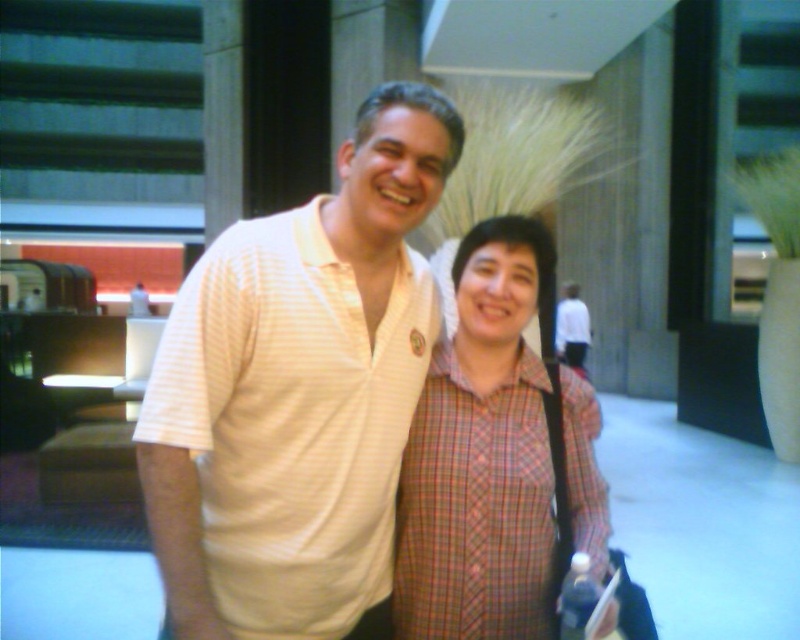
Question: Where is white striped polo shirt at center located in relation to plaid fabric shirt at center in the image?

Choices:
 (A) below
 (B) above

Answer: (B)

Question: Can you confirm if white striped polo shirt at center is positioned below plaid fabric shirt at center?

Choices:
 (A) yes
 (B) no

Answer: (B)

Question: Among these points, which one is nearest to the camera?

Choices:
 (A) (505, 483)
 (B) (330, 301)

Answer: (B)

Question: Does white striped polo shirt at center appear on the right side of plaid fabric shirt at center?

Choices:
 (A) no
 (B) yes

Answer: (A)